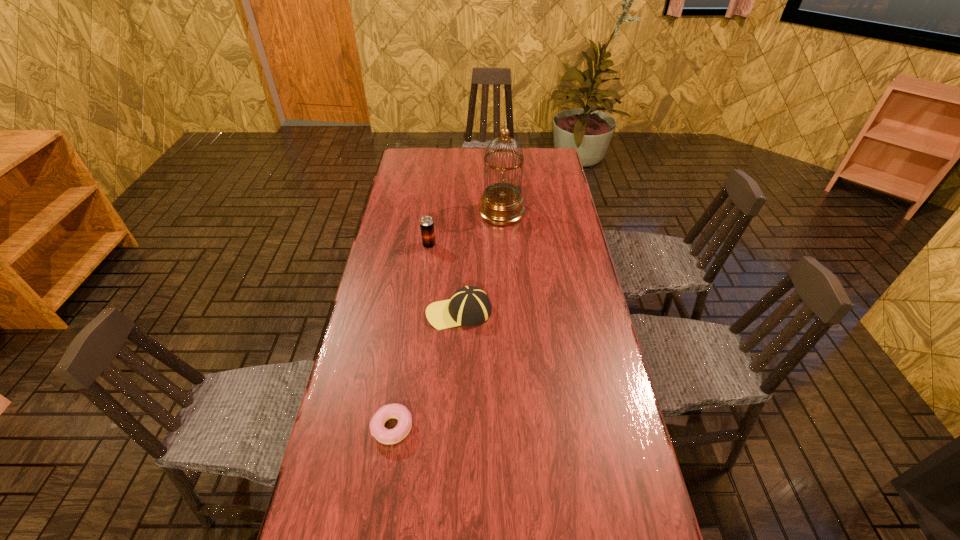
Where is `free space at the far left corner`? The width and height of the screenshot is (960, 540). free space at the far left corner is located at coordinates (431, 151).

Where is `vacant space that is in between the beer can and the nearest object`? The width and height of the screenshot is (960, 540). vacant space that is in between the beer can and the nearest object is located at coordinates (411, 336).

Where is `blank region between the beer can and the doughnut`? Image resolution: width=960 pixels, height=540 pixels. blank region between the beer can and the doughnut is located at coordinates (411, 336).

Find the location of `free space that is in between the farthest object and the beer can`. free space that is in between the farthest object and the beer can is located at coordinates (466, 229).

At what (x,y) coordinates should I click in order to perform the action: click on free space between the baseball cap and the farthest object. Please return your answer as a coordinate pair (x, y). This screenshot has height=540, width=960. Looking at the image, I should click on pyautogui.click(x=480, y=262).

Locate an element on the screen. vacant space that is in between the beer can and the second nearest object is located at coordinates (444, 279).

Where is `the third closest object to the nearest object`? The height and width of the screenshot is (540, 960). the third closest object to the nearest object is located at coordinates (501, 204).

In order to click on object that ranks as the closest to the tallest object in this screenshot , I will do `click(426, 223)`.

Locate an element on the screen. The width and height of the screenshot is (960, 540). vacant position in the image that satisfies the following two spatial constraints: 1. with an open door on the tallest object; 2. on the front side of the beer can is located at coordinates (504, 245).

Find the location of a particular element. The width and height of the screenshot is (960, 540). free space that satisfies the following two spatial constraints: 1. with the brim of the baseball cap facing forward; 2. on the front side of the doughnut is located at coordinates (454, 427).